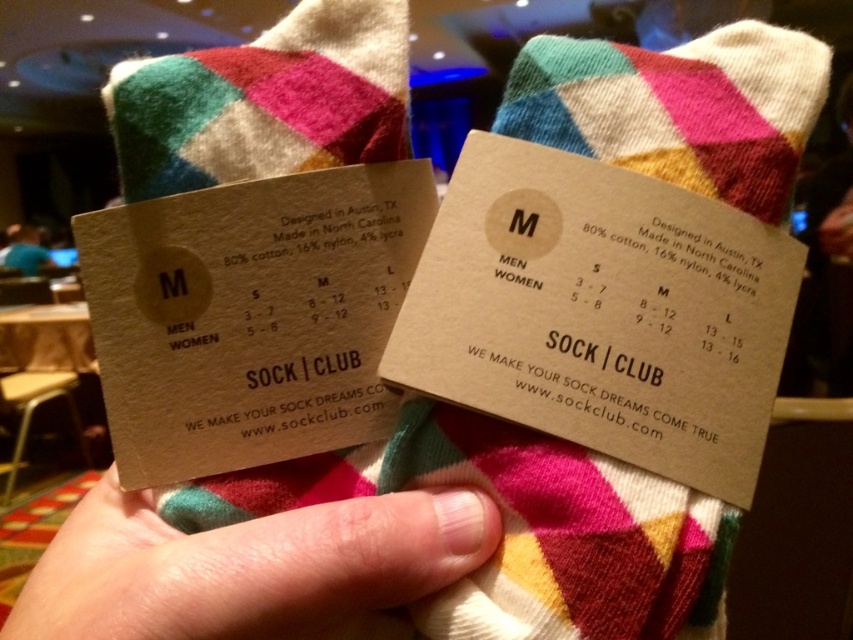
What is the exact location of the pink skin at center in the image?

The pink skin at center is located at point coordinates of (250, 568).

You are holding the two business cards from the image and want to place them on a desk. If you want to arrange them so that the pink skin at center is to the left of the multicolored woolen socks at center, would this arrangement be possible based on their current positions?

The pink skin at center is positioned on the right side of multicolored woolen socks at center, so to place the pink skin at center to the left of the multicolored woolen socks at center, you would need to rearrange them since their current positions have the pink skin at center on the right.

You are a customer looking at the two business cards from Sock Club. You notice the pink skin at center and the blue fabric shirt at upper left in the image. Which object is positioned more to the left?

The blue fabric shirt at upper left is positioned more to the left than the pink skin at center.